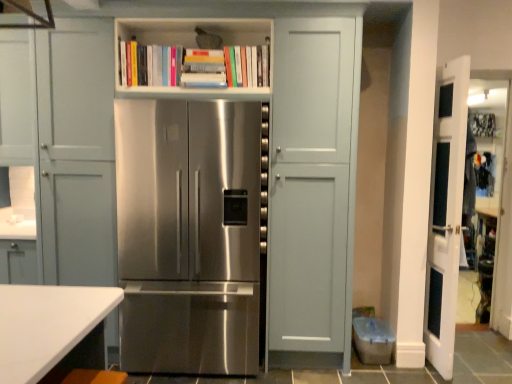
This screenshot has width=512, height=384. Describe the element at coordinates (446, 213) in the screenshot. I see `white glossy door at right` at that location.

In order to face stainless steel refrigerator at center, should I rotate leftwards or rightwards?

Turn left approximately 7.965 degrees to face it.

Image resolution: width=512 pixels, height=384 pixels. I want to click on stainless steel refrigerator at center, so click(x=189, y=235).

Locate an element on the screen. This screenshot has height=384, width=512. white glossy door at right is located at coordinates (446, 213).

In the scene shown: Based on their sizes in the image, would you say white matte bookshelf at upper center is bigger or smaller than white glossy door at right?

In the image, white matte bookshelf at upper center appears to be smaller than white glossy door at right.

From the image's perspective, would you say white matte bookshelf at upper center is shown under white glossy door at right?

No, from the image's perspective, white matte bookshelf at upper center is not below white glossy door at right.

Considering the positions of objects white matte bookshelf at upper center and white glossy door at right in the image provided, who is behind, white matte bookshelf at upper center or white glossy door at right?

white matte bookshelf at upper center is further away from the camera.

Considering the points (248, 26) and (435, 222), which point is behind, point (248, 26) or point (435, 222)?

The point (435, 222) is more distant.

From the picture: Considering the relative sizes of white glossy door at right and white matte bookshelf at upper center in the image provided, is white glossy door at right thinner than white matte bookshelf at upper center?

Indeed, white glossy door at right has a lesser width compared to white matte bookshelf at upper center.

Between point (469, 62) and point (170, 35), which one is positioned in front?

Point (469, 62)

Where is `door below the white matte bookshelf at upper center (from a real-world perspective)`? Image resolution: width=512 pixels, height=384 pixels. door below the white matte bookshelf at upper center (from a real-world perspective) is located at coordinates (446, 213).

From a real-world perspective, is white glossy door at right physically below white matte bookshelf at upper center?

Yes.

Is white glossy door at right oriented away from stainless steel refrigerator at center?

Yes, white glossy door at right is facing away from stainless steel refrigerator at center.

Consider the image. Is the surface of white glossy door at right in direct contact with stainless steel refrigerator at center?

No.

Considering the sizes of objects white glossy door at right and stainless steel refrigerator at center in the image provided, who is smaller, white glossy door at right or stainless steel refrigerator at center?

With smaller size is white glossy door at right.

Between white glossy door at right and stainless steel refrigerator at center, which one appears on the left side from the viewer's perspective?

From the viewer's perspective, stainless steel refrigerator at center appears more on the left side.

Which of these two, white matte bookshelf at upper center or stainless steel refrigerator at center, is smaller?

With smaller size is white matte bookshelf at upper center.

Is point (169, 91) farther from camera compared to point (249, 143)?

That is True.

Between white matte bookshelf at upper center and stainless steel refrigerator at center, which one has smaller width?

white matte bookshelf at upper center.

From the image's perspective, who appears lower, white matte bookshelf at upper center or stainless steel refrigerator at center?

stainless steel refrigerator at center.

From a real-world perspective, which is physically below, stainless steel refrigerator at center or white glossy door at right?

From a 3D spatial view, stainless steel refrigerator at center is below.

In the image, is stainless steel refrigerator at center on the left side or the right side of white glossy door at right?

stainless steel refrigerator at center is to the left of white glossy door at right.

Which object is further away from the camera, stainless steel refrigerator at center or white glossy door at right?

Positioned behind is white glossy door at right.

Consider the image. Is white matte bookshelf at upper center surrounded by stainless steel refrigerator at center?

No, stainless steel refrigerator at center does not contain white matte bookshelf at upper center.

Identify the location of shelf above the stainless steel refrigerator at center (from a real-world perspective). Image resolution: width=512 pixels, height=384 pixels. coord(194,52).

Based on their positions, is stainless steel refrigerator at center located to the left or right of white matte bookshelf at upper center?

Based on their positions, stainless steel refrigerator at center is located to the left of white matte bookshelf at upper center.

From the image's perspective, is stainless steel refrigerator at center below white matte bookshelf at upper center?

Indeed, from the image's perspective, stainless steel refrigerator at center is shown beneath white matte bookshelf at upper center.

Locate an element on the screen. door lying on the right of white matte bookshelf at upper center is located at coordinates (446, 213).

Find the location of a particular element. This screenshot has width=512, height=384. door located below the white matte bookshelf at upper center (from the image's perspective) is located at coordinates (446, 213).

Which object lies further to the anchor point white glossy door at right, white matte bookshelf at upper center or stainless steel refrigerator at center?

Among the two, white matte bookshelf at upper center is located further to white glossy door at right.

From the image, which object appears to be farther from stainless steel refrigerator at center, white matte bookshelf at upper center or white glossy door at right?

Among the two, white glossy door at right is located further to stainless steel refrigerator at center.

Which object lies nearer to the anchor point white matte bookshelf at upper center, white glossy door at right or stainless steel refrigerator at center?

stainless steel refrigerator at center lies closer to white matte bookshelf at upper center than the other object.

Which object lies further to the anchor point stainless steel refrigerator at center, white glossy door at right or white matte bookshelf at upper center?

Based on the image, white glossy door at right appears to be further to stainless steel refrigerator at center.

Consider the image. Which object lies further to the anchor point white matte bookshelf at upper center, stainless steel refrigerator at center or white glossy door at right?

white glossy door at right lies further to white matte bookshelf at upper center than the other object.

Estimate the real-world distances between objects in this image. Which object is further from white glossy door at right, stainless steel refrigerator at center or white matte bookshelf at upper center?

Among the two, white matte bookshelf at upper center is located further to white glossy door at right.

Find the location of a particular element. Image resolution: width=512 pixels, height=384 pixels. shelf situated between stainless steel refrigerator at center and white glossy door at right from left to right is located at coordinates (194, 52).